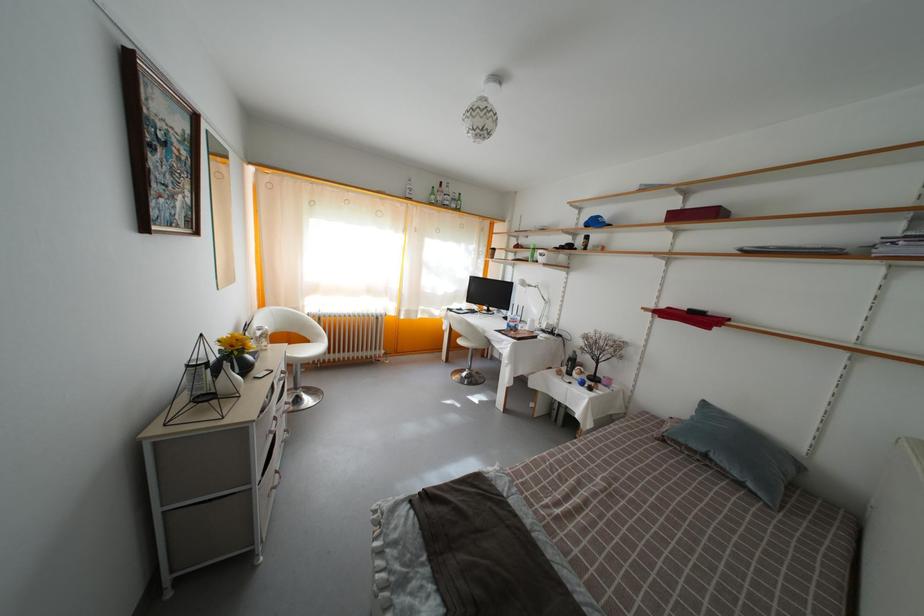
Identify the location of black spray bottle. This screenshot has height=616, width=924. (570, 363).